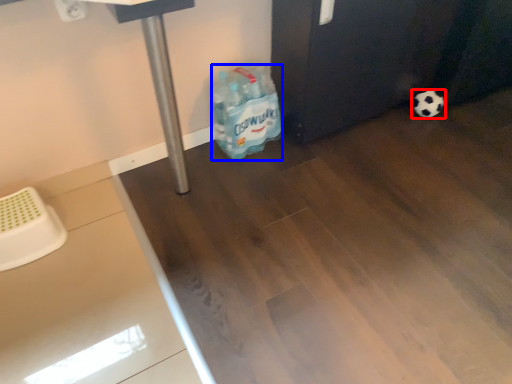
Question: Which object is closer to the camera taking this photo, football (highlighted by a red box) or cleaning product (highlighted by a blue box)?

Choices:
 (A) football
 (B) cleaning product

Answer: (B)